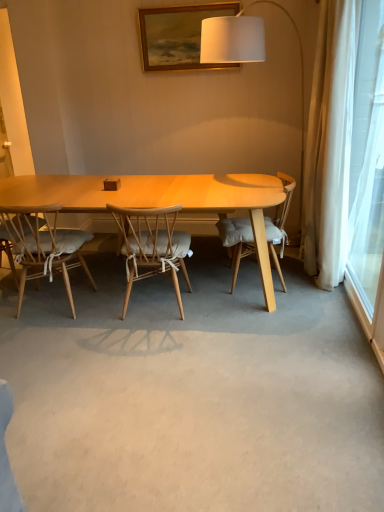
Question: From a real-world perspective, is transparent glass window at right physically above natural wood chair with cushion at center, the 2th chair in the left-to-right sequence?

Choices:
 (A) no
 (B) yes

Answer: (B)

Question: Is transparent glass window at right bigger than natural wood chair with cushion at center, which is the 2th chair from right to left?

Choices:
 (A) no
 (B) yes

Answer: (A)

Question: Could you tell me if transparent glass window at right is facing natural wood chair with cushion at center, which is the 2th chair from right to left?

Choices:
 (A) no
 (B) yes

Answer: (B)

Question: Is the depth of transparent glass window at right less than that of natural wood chair with cushion at center, which is the 2th chair from right to left?

Choices:
 (A) no
 (B) yes

Answer: (B)

Question: Is the position of transparent glass window at right more distant than that of natural wood chair with cushion at center, the 2th chair in the left-to-right sequence?

Choices:
 (A) yes
 (B) no

Answer: (B)

Question: Considering the relative sizes of transparent glass window at right and natural wood chair with cushion at center, the 2th chair in the left-to-right sequence, in the image provided, is transparent glass window at right wider than natural wood chair with cushion at center, the 2th chair in the left-to-right sequence,?

Choices:
 (A) no
 (B) yes

Answer: (A)

Question: From a real-world perspective, is light wood chair with white cushion at left, which is the first chair in left-to-right order, positioned under natural wood chair with cushion at center, which is the 2th chair from right to left, based on gravity?

Choices:
 (A) no
 (B) yes

Answer: (B)

Question: Is light wood chair with white cushion at left, which is the first chair in left-to-right order, behind natural wood chair with cushion at center, the 2th chair in the left-to-right sequence?

Choices:
 (A) yes
 (B) no

Answer: (A)

Question: Is light wood chair with white cushion at left, acting as the third chair starting from the right, located outside natural wood chair with cushion at center, the 2th chair in the left-to-right sequence?

Choices:
 (A) yes
 (B) no

Answer: (A)

Question: Is light wood chair with white cushion at left, which is the first chair in left-to-right order, next to natural wood chair with cushion at center, the 2th chair in the left-to-right sequence, and touching it?

Choices:
 (A) no
 (B) yes

Answer: (A)

Question: Considering the relative positions of light wood chair with white cushion at left, which is the first chair in left-to-right order, and natural wood chair with cushion at center, which is the 2th chair from right to left, in the image provided, is light wood chair with white cushion at left, which is the first chair in left-to-right order, to the left of natural wood chair with cushion at center, which is the 2th chair from right to left, from the viewer's perspective?

Choices:
 (A) no
 (B) yes

Answer: (B)

Question: From a real-world perspective, is light wood chair with white cushion at left, which is the first chair in left-to-right order, located higher than natural wood chair with cushion at center, the 2th chair in the left-to-right sequence?

Choices:
 (A) yes
 (B) no

Answer: (B)

Question: Is natural wood chair with cushion at center, which is the 2th chair from right to left, positioned with its back to light wood chair with cushion at center, the 1th chair positioned from the right?

Choices:
 (A) no
 (B) yes

Answer: (A)